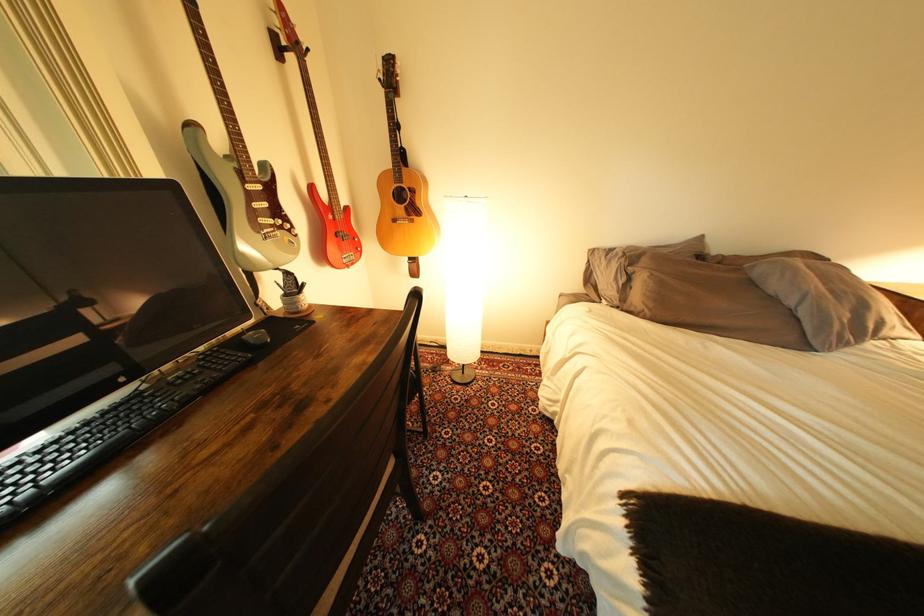
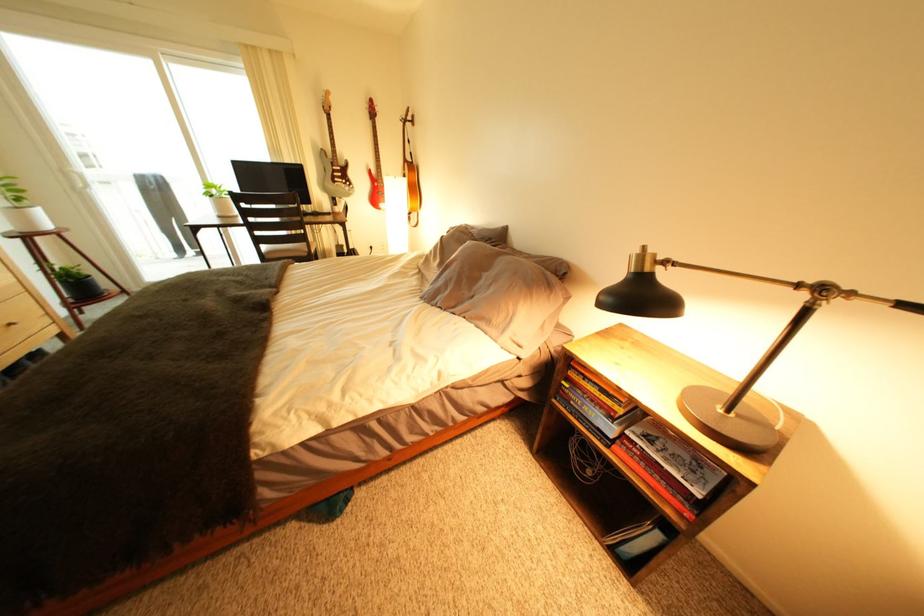
Where in the second image is the point corresponding to (x=278, y=233) from the first image?

(349, 185)